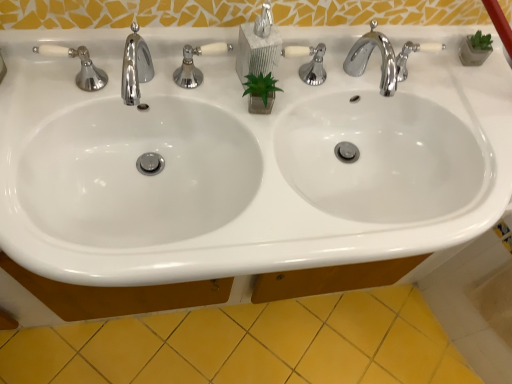
What are the coordinates of `vacant space situated above white glossy sink at center (from a real-world perspective)` in the screenshot? It's located at (250, 110).